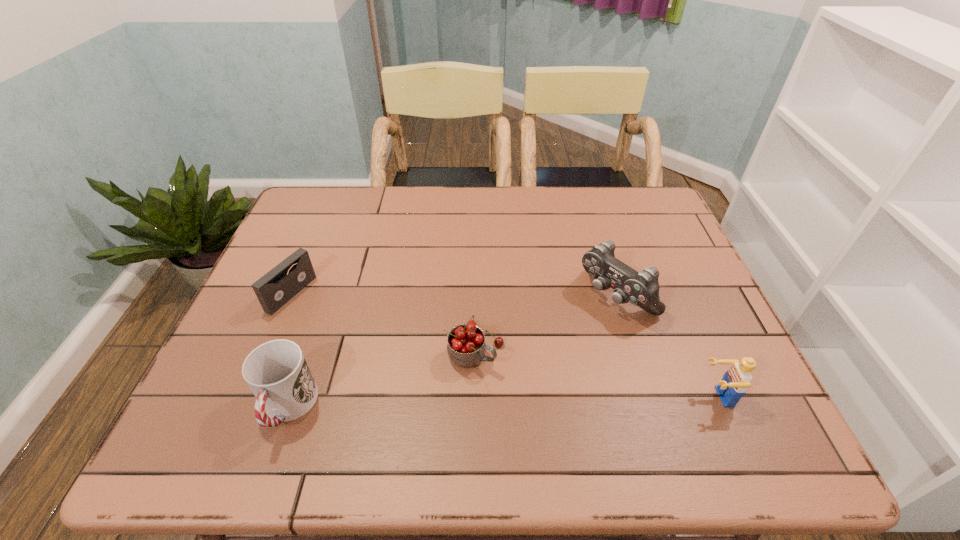
In order to click on videotape that is at the left edge in this screenshot , I will do `click(273, 290)`.

This screenshot has width=960, height=540. Find the location of `Lego situated at the right edge`. Lego situated at the right edge is located at coordinates (737, 379).

The height and width of the screenshot is (540, 960). I want to click on control positioned at the right edge, so click(641, 289).

At what (x,y) coordinates should I click in order to perform the action: click on object that is at the near left corner. Please return your answer as a coordinate pair (x, y). This screenshot has width=960, height=540. Looking at the image, I should click on (277, 373).

Locate an element on the screen. This screenshot has width=960, height=540. object located at the near right corner is located at coordinates (737, 379).

In the image, there is a desktop. Where is `vacant space at the far edge`? vacant space at the far edge is located at coordinates (446, 201).

What are the coordinates of `vacant space at the near edge` in the screenshot? It's located at (642, 410).

Locate an element on the screen. This screenshot has width=960, height=540. free spot at the right edge of the desktop is located at coordinates (659, 327).

This screenshot has width=960, height=540. I want to click on free spot at the far left corner of the desktop, so click(x=346, y=187).

Identify the location of free region at the far right corner of the desktop. (613, 213).